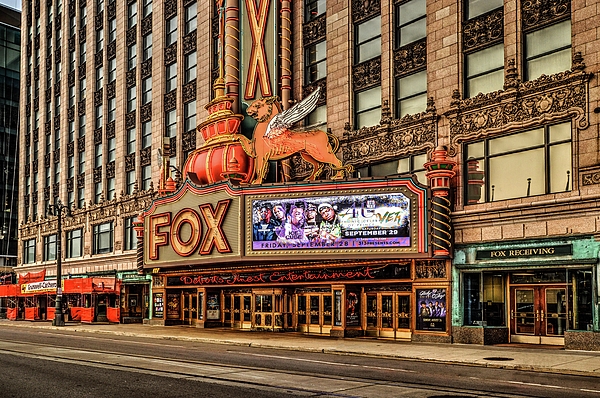
Identify the location of glass. (373, 300).